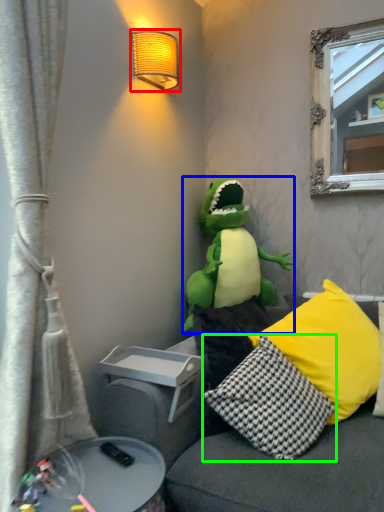
Question: Considering the real-world distances, which object is farthest from lamp (highlighted by a red box)? toy (highlighted by a blue box) or pillow (highlighted by a green box)?

Choices:
 (A) toy
 (B) pillow

Answer: (B)